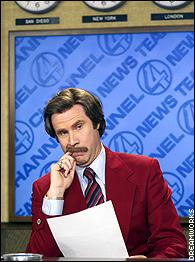
Where is `left clock`? The width and height of the screenshot is (195, 262). left clock is located at coordinates (37, 8).